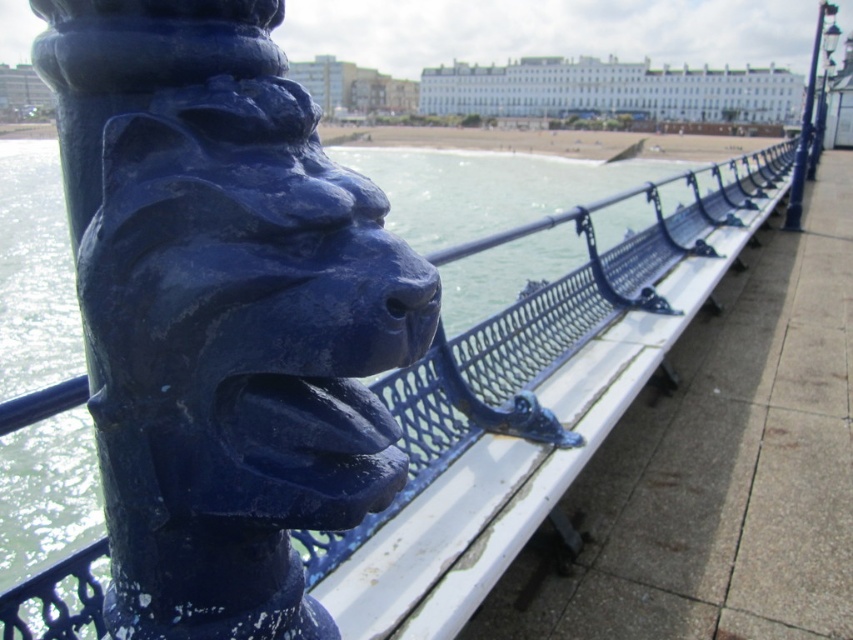
Does glossy metal fence at center have a lesser width compared to blue painted metal pole at upper right?

No.

Where is `glossy metal fence at center`? This screenshot has width=853, height=640. glossy metal fence at center is located at coordinates (546, 323).

Between matte blue lion head at center and glossy metal fence at center, which one appears on the left side from the viewer's perspective?

From the viewer's perspective, matte blue lion head at center appears more on the left side.

From the picture: Who is more distant from viewer, [265,24] or [648,211]?

Positioned behind is point [648,211].

Does point (161, 604) come in front of point (585, 339)?

Yes, point (161, 604) is in front of point (585, 339).

The image size is (853, 640). Find the location of `matte blue lion head at center`. matte blue lion head at center is located at coordinates (222, 312).

Which is below, matte blue lion head at center or blue painted metal pole at upper right?

Positioned lower is matte blue lion head at center.

Which is in front, point (248, 182) or point (811, 80)?

Positioned in front is point (248, 182).

Image resolution: width=853 pixels, height=640 pixels. What are the coordinates of `matte blue lion head at center` in the screenshot? It's located at (222, 312).